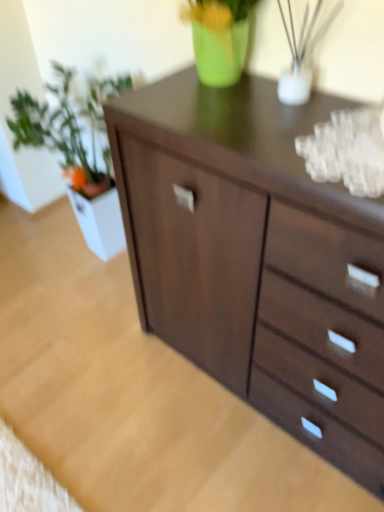
This screenshot has height=512, width=384. I want to click on vacant space in front of green matte plant at left, so click(x=81, y=333).